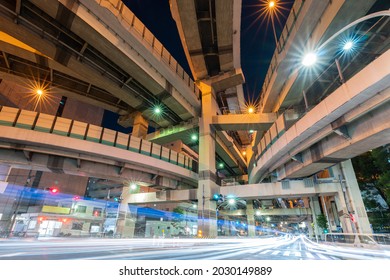
This screenshot has width=390, height=280. What are the coordinates of `lights` in the screenshot? It's located at (37, 97).